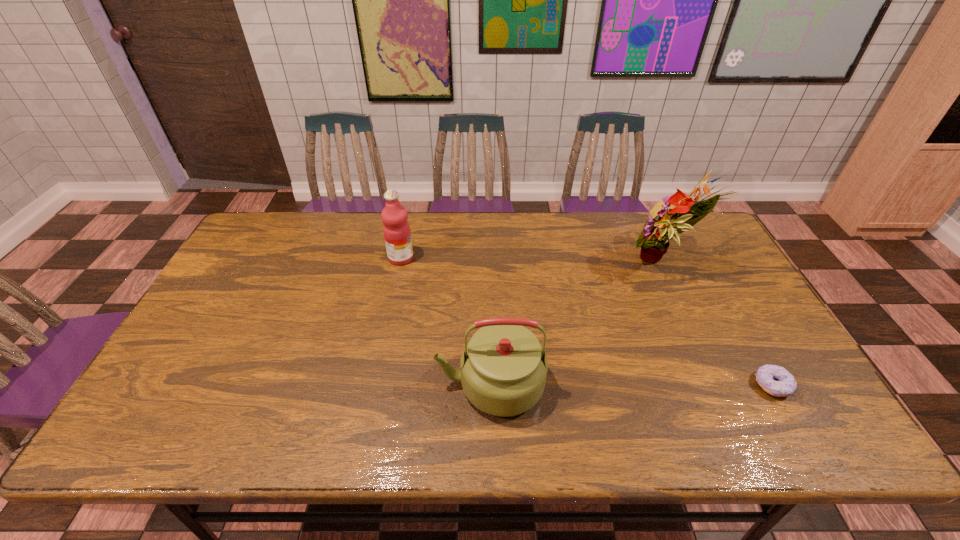
Locate an element on the screen. This screenshot has height=540, width=960. vacant space located 0.370m at the spout of the kettle is located at coordinates (284, 384).

Where is `blank space located on the back of the doughnut`? blank space located on the back of the doughnut is located at coordinates (750, 345).

I want to click on bouquet located in the far edge section of the desktop, so point(654,239).

The image size is (960, 540). I want to click on fruit juice located in the far edge section of the desktop, so click(x=396, y=229).

Where is `object present at the near edge`? This screenshot has height=540, width=960. object present at the near edge is located at coordinates (503, 373).

You are a GUI agent. You are given a task and a screenshot of the screen. Output one action in this format:
    pyautogui.click(x=<x>, y=<y>)
    Task: Click on the bouquet that is at the right edge
    The height and width of the screenshot is (540, 960).
    Given the screenshot: What is the action you would take?
    pyautogui.click(x=654, y=239)

Find the location of a particular element. The height and width of the screenshot is (540, 960). doughnut located at the right edge is located at coordinates tap(775, 380).

Locate an element on the screen. object that is at the far right corner is located at coordinates (654, 239).

This screenshot has width=960, height=540. In the image, there is a desktop. What are the coordinates of `vacant space at the far edge` in the screenshot? It's located at (412, 238).

In the image, there is a desktop. Find the location of `blank space at the near edge`. blank space at the near edge is located at coordinates (743, 415).